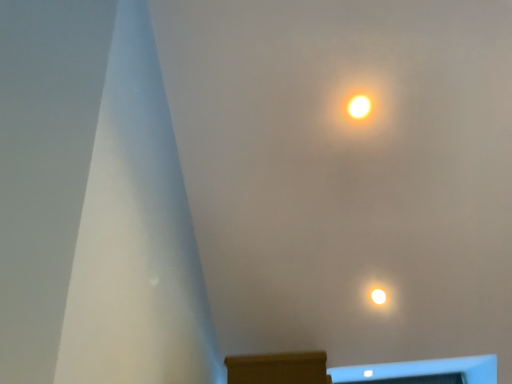
This screenshot has width=512, height=384. I want to click on brown wood mantle at lower center, so click(278, 368).

What do you see at coordinates (278, 368) in the screenshot? This screenshot has height=384, width=512. I see `brown wood mantle at lower center` at bounding box center [278, 368].

The width and height of the screenshot is (512, 384). In order to click on bright yellow bulb at upper center in this screenshot , I will do `click(359, 106)`.

Describe the element at coordinates (359, 106) in the screenshot. I see `bright yellow bulb at upper center` at that location.

Locate an element on the screen. brown wood mantle at lower center is located at coordinates (278, 368).

Is brown wood mantle at lower center at the left side of bright yellow bulb at upper center?

Correct, you'll find brown wood mantle at lower center to the left of bright yellow bulb at upper center.

Relative to bright yellow bulb at upper center, is brown wood mantle at lower center in front or behind?

Visually, brown wood mantle at lower center is located in front of bright yellow bulb at upper center.

Does point (323, 383) appear closer or farther from the camera than point (356, 95)?

Point (323, 383).

From the image's perspective, which object appears higher, brown wood mantle at lower center or bright yellow bulb at upper center?

bright yellow bulb at upper center is shown above in the image.

From a real-world perspective, relative to bright yellow bulb at upper center, is brown wood mantle at lower center vertically above or below?

brown wood mantle at lower center is situated lower than bright yellow bulb at upper center in the real world.

Which of these two, brown wood mantle at lower center or bright yellow bulb at upper center, is wider?

Wider between the two is brown wood mantle at lower center.

Considering the sizes of objects brown wood mantle at lower center and bright yellow bulb at upper center in the image provided, who is shorter, brown wood mantle at lower center or bright yellow bulb at upper center?

With less height is brown wood mantle at lower center.

Is brown wood mantle at lower center bigger than bright yellow bulb at upper center?

Yes, brown wood mantle at lower center is bigger than bright yellow bulb at upper center.

Do you think brown wood mantle at lower center is within bright yellow bulb at upper center, or outside of it?

brown wood mantle at lower center is outside bright yellow bulb at upper center.

Are brown wood mantle at lower center and bright yellow bulb at upper center located far from each other?

brown wood mantle at lower center is far away from bright yellow bulb at upper center.

Is brown wood mantle at lower center looking in the opposite direction of bright yellow bulb at upper center?

No, brown wood mantle at lower center's orientation is not away from bright yellow bulb at upper center.

Can you tell me how much brown wood mantle at lower center and bright yellow bulb at upper center differ in facing direction?

93.3 degrees.

Identify the location of lamp located on the right of brown wood mantle at lower center. (359, 106).

Is bright yellow bulb at upper center at the left side of brown wood mantle at lower center?

No, bright yellow bulb at upper center is not to the left of brown wood mantle at lower center.

Which is behind, bright yellow bulb at upper center or brown wood mantle at lower center?

bright yellow bulb at upper center.

Does point (367, 104) appear closer or farther from the camera than point (230, 365)?

Clearly, point (367, 104) is more distant from the camera than point (230, 365).

From the image's perspective, is bright yellow bulb at upper center above brown wood mantle at lower center?

Indeed, from the image's perspective, bright yellow bulb at upper center is shown above brown wood mantle at lower center.

From a real-world perspective, which is physically above, bright yellow bulb at upper center or brown wood mantle at lower center?

In real-world perspective, bright yellow bulb at upper center is above.

Considering the relative sizes of bright yellow bulb at upper center and brown wood mantle at lower center in the image provided, is bright yellow bulb at upper center thinner than brown wood mantle at lower center?

Indeed, bright yellow bulb at upper center has a lesser width compared to brown wood mantle at lower center.

Is bright yellow bulb at upper center shorter than brown wood mantle at lower center?

No, bright yellow bulb at upper center is not shorter than brown wood mantle at lower center.

Considering the sizes of objects bright yellow bulb at upper center and brown wood mantle at lower center in the image provided, who is smaller, bright yellow bulb at upper center or brown wood mantle at lower center?

Smaller between the two is bright yellow bulb at upper center.

Choose the correct answer: Is bright yellow bulb at upper center inside brown wood mantle at lower center or outside it?

→ bright yellow bulb at upper center exists outside the volume of brown wood mantle at lower center.

Based on the photo, are bright yellow bulb at upper center and brown wood mantle at lower center located far from each other?

Yes, bright yellow bulb at upper center and brown wood mantle at lower center are quite far apart.

Is bright yellow bulb at upper center oriented away from brown wood mantle at lower center?

No, brown wood mantle at lower center is not at the back of bright yellow bulb at upper center.

From the picture: How different are the orientations of bright yellow bulb at upper center and brown wood mantle at lower center in degrees?

93.3 degrees separate the facing orientations of bright yellow bulb at upper center and brown wood mantle at lower center.

Image resolution: width=512 pixels, height=384 pixels. In order to click on furniture below the bright yellow bulb at upper center (from a real-world perspective) in this screenshot , I will do `click(278, 368)`.

At what (x,y) coordinates should I click in order to perform the action: click on lamp behind the brown wood mantle at lower center. Please return your answer as a coordinate pair (x, y). The height and width of the screenshot is (384, 512). Looking at the image, I should click on (359, 106).

You are a GUI agent. You are given a task and a screenshot of the screen. Output one action in this format:
    pyautogui.click(x=<x>, y=<y>)
    Task: Click on the furniture on the left of the bright yellow bulb at upper center
    
    Given the screenshot: What is the action you would take?
    pyautogui.click(x=278, y=368)